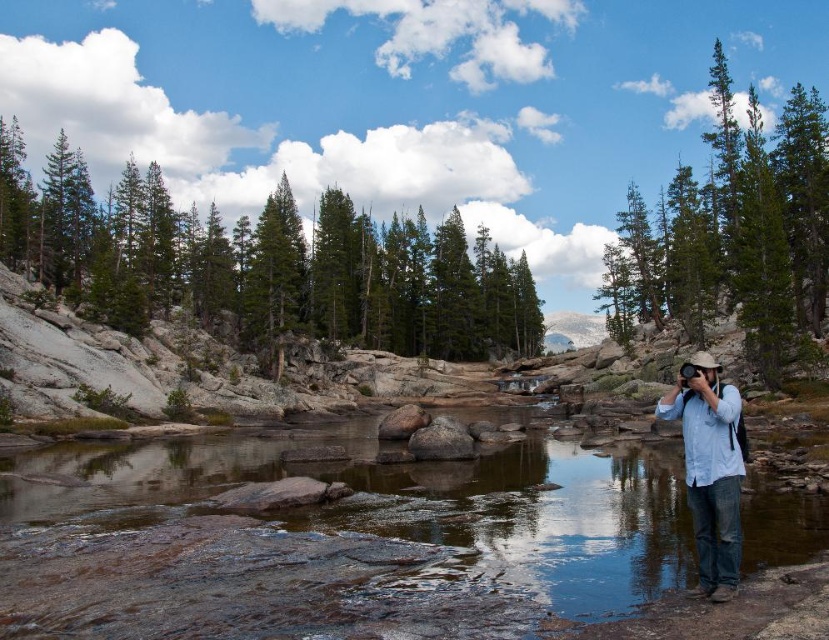
Is point (365, 426) less distant than point (362, 228)?

Yes, point (365, 426) is closer to viewer.

How much distance is there between clear water at center and green textured trees at upper center?

clear water at center is 318.72 feet away from green textured trees at upper center.

Is point (183, 492) positioned in front of point (124, 289)?

Yes, it is.

The image size is (829, 640). I want to click on clear water at center, so click(356, 538).

From the picture: Can you confirm if clear water at center is wider than light blue denim shirt at center-right?

Correct, the width of clear water at center exceeds that of light blue denim shirt at center-right.

Does clear water at center have a lesser width compared to light blue denim shirt at center-right?

No.

This screenshot has height=640, width=829. What do you see at coordinates (356, 538) in the screenshot?
I see `clear water at center` at bounding box center [356, 538].

Where is `clear water at center`? clear water at center is located at coordinates (356, 538).

Which of these two, green textured trees at upper center or green matte tree at upper right, stands taller?

Standing taller between the two is green textured trees at upper center.

How far apart are green textured trees at upper center and green matte tree at upper right?

green textured trees at upper center and green matte tree at upper right are 258.65 feet apart.

Is point (293, 330) more distant than point (788, 163)?

Yes, point (293, 330) is farther from viewer.

This screenshot has height=640, width=829. I want to click on green textured trees at upper center, so click(x=263, y=264).